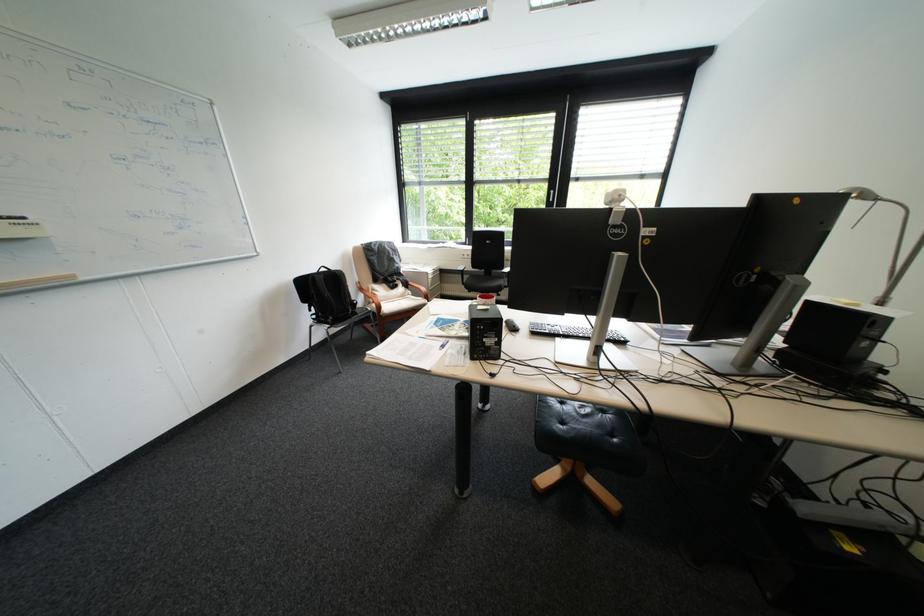
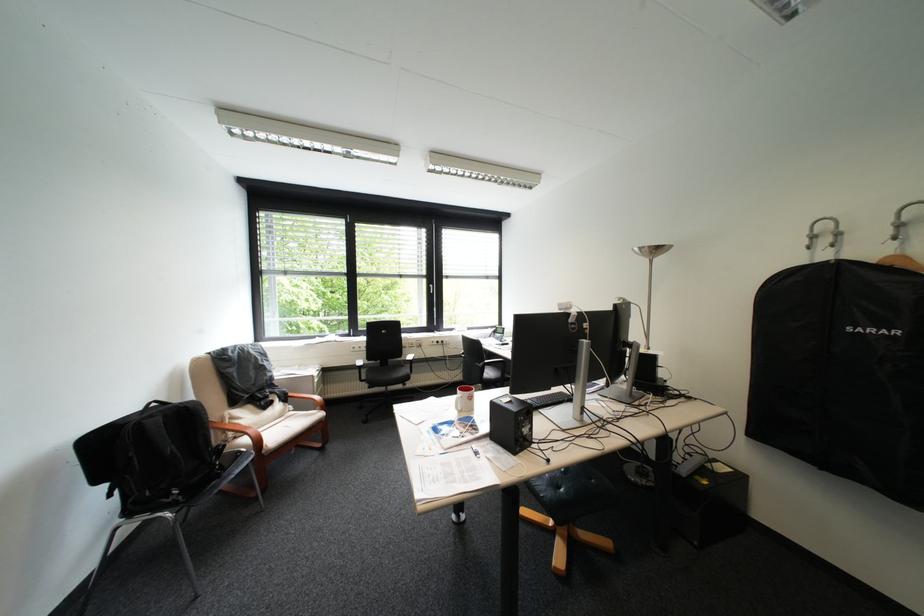
The point at [475,273] is marked in the first image. Where is the corresponding point in the second image?

(371, 368)